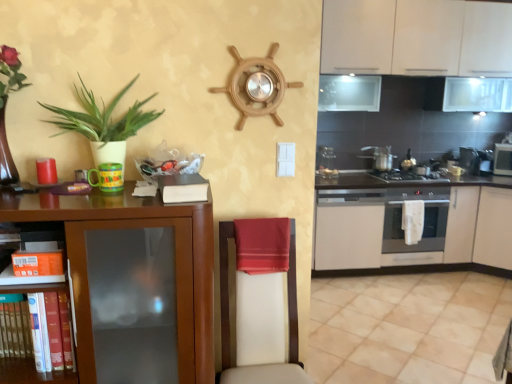
What is the approximate width of brown wood cabinet at left, the 4th cabinetry from the back?

brown wood cabinet at left, the 4th cabinetry from the back, is 50.21 centimeters in width.

Where is `brown wood cabinet at left, the 4th cabinetry from the back`? brown wood cabinet at left, the 4th cabinetry from the back is located at coordinates point(134,282).

The height and width of the screenshot is (384, 512). I want to click on silver metallic pot at center, the third appliance positioned from the left, so click(381, 157).

This screenshot has width=512, height=384. Describe the element at coordinates (397, 209) in the screenshot. I see `white matte oven at right, the 3th cabinetry when ordered from front to back` at that location.

This screenshot has width=512, height=384. What do you see at coordinates (103, 123) in the screenshot?
I see `green matte plant at left` at bounding box center [103, 123].

Describe the element at coordinates (417, 37) in the screenshot. This screenshot has height=384, width=512. I see `white matte cabinet at upper right, which ranks as the third cabinetry in back-to-front order` at that location.

Describe the element at coordinates (108, 177) in the screenshot. The image size is (512, 384). I see `matte plastic cup at left, the first appliance when ordered from front to back` at that location.

Locate an element on the screen. The height and width of the screenshot is (384, 512). brown wood cabinet at left, the first cabinetry from the front is located at coordinates (134, 282).

Could you tell me if red satin towel at center is facing stainless steel oven at right, arranged as the fourth appliance when viewed from the front?

No, red satin towel at center is not oriented towards stainless steel oven at right, arranged as the fourth appliance when viewed from the front.

What's the angular difference between red satin towel at center and stainless steel oven at right, arranged as the second appliance when viewed from the right,'s facing directions?

red satin towel at center and stainless steel oven at right, arranged as the second appliance when viewed from the right, are facing 0.647 degrees away from each other.

Considering their positions, is red satin towel at center located in front of or behind stainless steel oven at right, the 5th appliance when ordered from left to right?

Clearly, red satin towel at center is in front of stainless steel oven at right, the 5th appliance when ordered from left to right.

Is red satin towel at center to the left or to the right of stainless steel oven at right, arranged as the fourth appliance when viewed from the front, in the image?

From the image, it's evident that red satin towel at center is to the left of stainless steel oven at right, arranged as the fourth appliance when viewed from the front.

Considering the points (495, 172) and (418, 3), which point is behind, point (495, 172) or point (418, 3)?

The point (495, 172) is farther from the camera.

Is metallic stainless steel microwave at right, the 1th appliance from the right, positioned far away from white matte cabinet at upper right, which ranks as the third cabinetry in back-to-front order?

metallic stainless steel microwave at right, the 1th appliance from the right, is far away from white matte cabinet at upper right, which ranks as the third cabinetry in back-to-front order.

Considering the sizes of metallic stainless steel microwave at right, marked as the second appliance in a back-to-front arrangement, and white matte cabinet at upper right, which ranks as the third cabinetry in back-to-front order, in the image, is metallic stainless steel microwave at right, marked as the second appliance in a back-to-front arrangement, taller or shorter than white matte cabinet at upper right, which ranks as the third cabinetry in back-to-front order,?

Considering their sizes, metallic stainless steel microwave at right, marked as the second appliance in a back-to-front arrangement, has less height than white matte cabinet at upper right, which ranks as the third cabinetry in back-to-front order.

Considering the relative positions of brown wood cabinet at left, the first cabinetry from the front, and matte plastic cup at left, the 1th appliance when ordered from left to right, in the image provided, is brown wood cabinet at left, the first cabinetry from the front, to the left or to the right of matte plastic cup at left, the 1th appliance when ordered from left to right,?

brown wood cabinet at left, the first cabinetry from the front, is to the left of matte plastic cup at left, the 1th appliance when ordered from left to right.

Which is behind, point (93, 242) or point (115, 184)?

The point (115, 184) is more distant.

Is matte plastic cup at left, the first appliance when ordered from front to back, at the back of brown wood cabinet at left, the first cabinetry from the front?

brown wood cabinet at left, the first cabinetry from the front, does not have its back to matte plastic cup at left, the first appliance when ordered from front to back.

Which of these two, brown wood cabinet at left, the 4th cabinetry from the back, or matte plastic cup at left, the first appliance when ordered from front to back, is bigger?

brown wood cabinet at left, the 4th cabinetry from the back.

Is matte plastic cup at left, the sixth appliance viewed from the back, not near white leather swivel chair at center?

No, matte plastic cup at left, the sixth appliance viewed from the back, is not far from white leather swivel chair at center.

Considering their positions, is matte plastic cup at left, the 1th appliance when ordered from left to right, located in front of or behind white leather swivel chair at center?

Clearly, matte plastic cup at left, the 1th appliance when ordered from left to right, is behind white leather swivel chair at center.

Who is bigger, matte plastic cup at left, the sixth appliance from the right, or white leather swivel chair at center?

Bigger between the two is white leather swivel chair at center.

From a real-world perspective, which object stands above the other?

matte plastic cup at left, the sixth appliance viewed from the back, from a real-world perspective.

Is metallic silver oven at right, which is the first appliance in back-to-front order, smaller than white matte cabinet at upper right, which ranks as the third cabinetry in back-to-front order?

Yes.

From the picture: Choose the correct answer: Is metallic silver oven at right, the third appliance when ordered from right to left, inside white matte cabinet at upper right, which is the 2th cabinetry in front-to-back order, or outside it?

metallic silver oven at right, the third appliance when ordered from right to left, is outside white matte cabinet at upper right, which is the 2th cabinetry in front-to-back order.

Considering the relative positions of metallic silver oven at right, which is the first appliance in back-to-front order, and white matte cabinet at upper right, which is the 2th cabinetry in front-to-back order, in the image provided, is metallic silver oven at right, which is the first appliance in back-to-front order, behind white matte cabinet at upper right, which is the 2th cabinetry in front-to-back order,?

Yes, metallic silver oven at right, which is the first appliance in back-to-front order, is behind white matte cabinet at upper right, which is the 2th cabinetry in front-to-back order.

Could you tell me if metallic silver oven at right, which is the first appliance in back-to-front order, is facing white matte cabinet at upper right, which ranks as the third cabinetry in back-to-front order?

No, metallic silver oven at right, which is the first appliance in back-to-front order, does not turn towards white matte cabinet at upper right, which ranks as the third cabinetry in back-to-front order.

Is stainless steel oven at right, positioned as the 3th appliance in back-to-front order, directly adjacent to orange cardboard box at lower left?

No, stainless steel oven at right, positioned as the 3th appliance in back-to-front order, is not beside orange cardboard box at lower left.

You are a GUI agent. You are given a task and a screenshot of the screen. Output one action in this format:
    pyautogui.click(x=<x>, y=<y>)
    Task: Click on the shelf on the left of the stainless steel oven at right, the 5th appliance when ordered from left to right
    
    Given the screenshot: What is the action you would take?
    pyautogui.click(x=37, y=255)

Is point (477, 157) positioned before point (48, 271)?

No, it is behind (48, 271).

From the image's perspective, is white matte cabinet at lower right, positioned as the 1th cabinetry in back-to-front order, beneath white matte cabinet at upper right, which ranks as the third cabinetry in back-to-front order?

Indeed, from the image's perspective, white matte cabinet at lower right, positioned as the 1th cabinetry in back-to-front order, is shown beneath white matte cabinet at upper right, which ranks as the third cabinetry in back-to-front order.

Is white matte cabinet at lower right, positioned as the 1th cabinetry in back-to-front order, taller or shorter than white matte cabinet at upper right, which is the 2th cabinetry in front-to-back order?

Considering their sizes, white matte cabinet at lower right, positioned as the 1th cabinetry in back-to-front order, has less height than white matte cabinet at upper right, which is the 2th cabinetry in front-to-back order.

Is white matte cabinet at lower right, which appears as the 4th cabinetry when viewed from the front, completely or partially outside of white matte cabinet at upper right, which is the 2th cabinetry in front-to-back order?

Yes, white matte cabinet at lower right, which appears as the 4th cabinetry when viewed from the front, is not within white matte cabinet at upper right, which is the 2th cabinetry in front-to-back order.

From the image's perspective, count 3rd appliances upward from the red satin towel at center and point to it. Please provide its 2D coordinates.

[(482, 162)]

Find the location of a particular element. The image size is (512, 384). the 1st cabinetry counting from the left of the metallic stainless steel microwave at right, the 1th appliance from the right is located at coordinates (417, 37).

Looking at this image, based on their spatial positions, is stainless steel oven at right, the 5th appliance when ordered from left to right, or red satin towel at center further from beige ceramic tile at lower right?

stainless steel oven at right, the 5th appliance when ordered from left to right, is further to beige ceramic tile at lower right.

Estimate the real-world distances between objects in this image. Which object is closer to orange cardboard box at lower left, metallic stainless steel microwave at right, the 1th appliance from the right, or beige ceramic tile at lower right?

beige ceramic tile at lower right is positioned closer to the anchor orange cardboard box at lower left.

From the image, which object appears to be farther from wooden ship wheel at upper center, acting as the fifth appliance starting from the back, brown wood cabinet at left, the first cabinetry from the front, or stainless steel oven at right, the 5th appliance when ordered from left to right?

Among the two, stainless steel oven at right, the 5th appliance when ordered from left to right, is located further to wooden ship wheel at upper center, acting as the fifth appliance starting from the back.

Which object lies further to the anchor point white matte cabinet at upper right, which ranks as the third cabinetry in back-to-front order, beige ceramic tile at lower right or matte plastic cup at left, the first appliance when ordered from front to back?

matte plastic cup at left, the first appliance when ordered from front to back, is positioned further to the anchor white matte cabinet at upper right, which ranks as the third cabinetry in back-to-front order.

Estimate the real-world distances between objects in this image. Which object is closer to wooden ship wheel at upper center, the 5th appliance when ordered from right to left, white matte cabinet at upper right, which ranks as the third cabinetry in back-to-front order, or white matte cabinet at lower right, which appears as the 4th cabinetry when viewed from the front?

white matte cabinet at lower right, which appears as the 4th cabinetry when viewed from the front, is closer to wooden ship wheel at upper center, the 5th appliance when ordered from right to left.

When comparing their distances from metallic silver oven at right, marked as the 6th appliance in a front-to-back arrangement, does red satin towel at center or white matte cabinet at upper right, which is the 2th cabinetry in front-to-back order, seem closer?

The object closer to metallic silver oven at right, marked as the 6th appliance in a front-to-back arrangement, is white matte cabinet at upper right, which is the 2th cabinetry in front-to-back order.

When comparing their distances from wooden ship wheel at upper center, which ranks as the 2th appliance in left-to-right order, does white leather swivel chair at center or green matte plant at left seem further?

white leather swivel chair at center is positioned further to the anchor wooden ship wheel at upper center, which ranks as the 2th appliance in left-to-right order.

Estimate the real-world distances between objects in this image. Which object is closer to metallic silver gas stove at center, white leather swivel chair at center or wooden ship wheel at upper center, acting as the fifth appliance starting from the back?

white leather swivel chair at center is positioned closer to the anchor metallic silver gas stove at center.

The image size is (512, 384). I want to click on blanket between brown wood cabinet at left, the 4th cabinetry from the back, and stainless steel oven at right, arranged as the second appliance when viewed from the right, along the z-axis, so click(262, 245).

Where is `blanket between green matte plant at left and white leather swivel chair at center from top to bottom`? blanket between green matte plant at left and white leather swivel chair at center from top to bottom is located at coordinates (262, 245).

Where is `tile positioned between white leather swivel chair at center and white matte cabinet at lower right, which appears as the 4th cabinetry when viewed from the front, from near to far`? This screenshot has width=512, height=384. tile positioned between white leather swivel chair at center and white matte cabinet at lower right, which appears as the 4th cabinetry when viewed from the front, from near to far is located at coordinates (407, 328).

The height and width of the screenshot is (384, 512). Identify the location of gas stove between brown wood cabinet at left, the first cabinetry from the front, and silver metallic pot at center, which is the 4th appliance in right-to-left order, in the front-back direction. (404, 177).